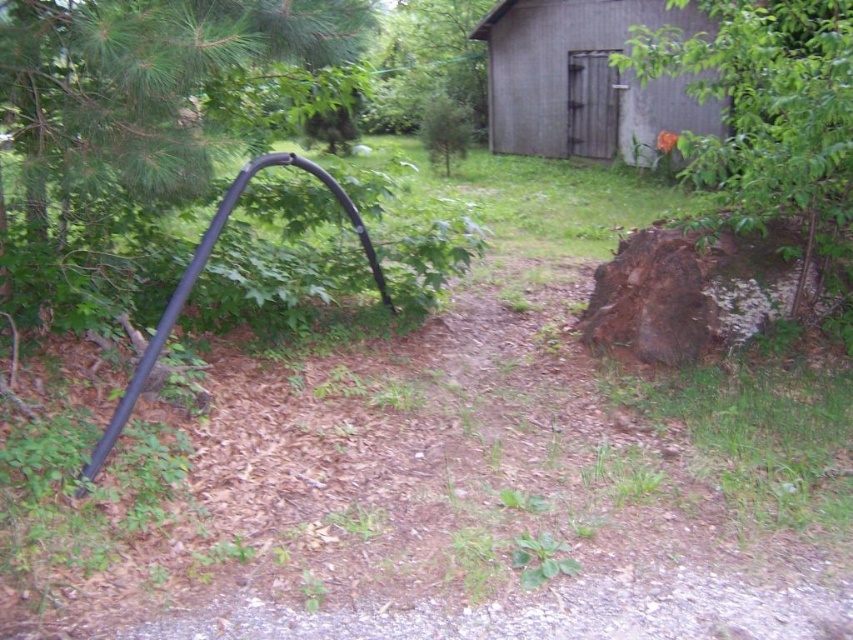
Question: Which point is closer to the camera?

Choices:
 (A) green leafy tree at upper center
 (B) black rubber hose at left
 (C) gray wood hut at upper center

Answer: (B)

Question: Does rough bark tree stump at right have a greater width compared to gray wood hut at upper center?

Choices:
 (A) no
 (B) yes

Answer: (A)

Question: Among these objects, which one is nearest to the camera?

Choices:
 (A) rough bark tree stump at right
 (B) black rubber hose at left
 (C) gray wood hut at upper center

Answer: (B)

Question: Among these objects, which one is farthest from the camera?

Choices:
 (A) black rubber hose at left
 (B) gray wood hut at upper center
 (C) green leafy tree at upper center

Answer: (C)

Question: Is black rubber hose at left smaller than rough bark tree stump at right?

Choices:
 (A) no
 (B) yes

Answer: (B)

Question: Can you confirm if rough bark tree stump at right is positioned to the left of green leafy tree at upper center?

Choices:
 (A) no
 (B) yes

Answer: (A)